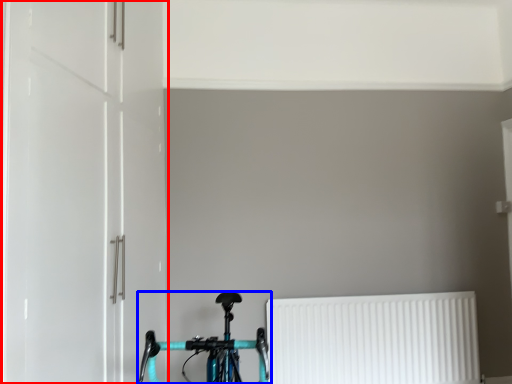
Question: Among these objects, which one is nearest to the camera, door (highlighted by a red box) or bicycle (highlighted by a blue box)?

Choices:
 (A) door
 (B) bicycle

Answer: (B)